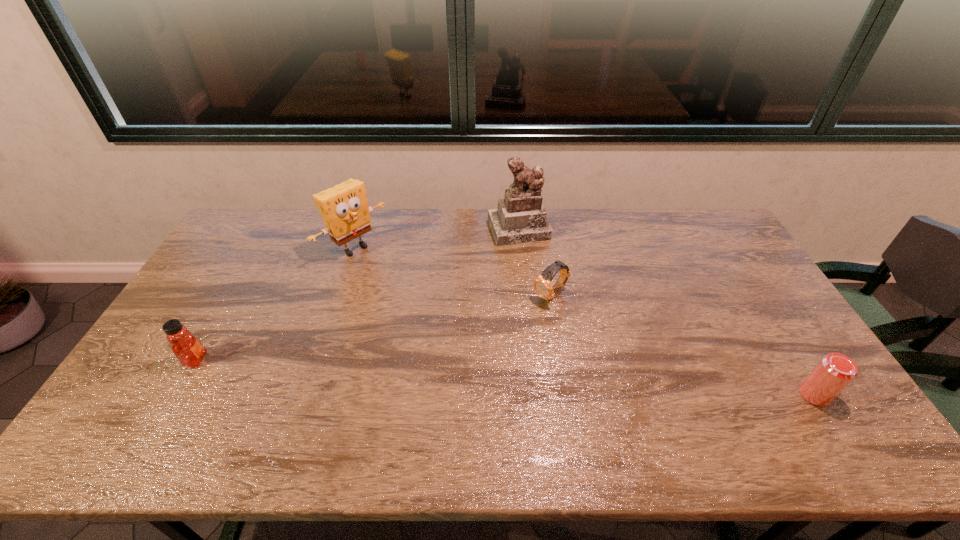
This screenshot has width=960, height=540. Identify the location of vacant space located on the face of the third farthest object. (474, 354).

Identify the location of free space located 0.140m on the face of the third farthest object. (507, 329).

Locate an element on the screen. The image size is (960, 540). free space located 0.130m on the face of the third farthest object is located at coordinates (509, 327).

The height and width of the screenshot is (540, 960). I want to click on free space located 0.220m on the front-facing side of the figurine, so click(x=542, y=289).

What are the coordinates of `vacant space located 0.380m on the front-facing side of the figurine` in the screenshot? It's located at (557, 327).

Where is `vacant area located 0.170m on the front-facing side of the figurine`? vacant area located 0.170m on the front-facing side of the figurine is located at coordinates (539, 279).

You are a GUI agent. You are given a task and a screenshot of the screen. Output one action in this format:
    pyautogui.click(x=<x>, y=<y>)
    Task: Click on the free space located on the face of the second tallest object
    The width and height of the screenshot is (960, 540).
    Given the screenshot: What is the action you would take?
    pyautogui.click(x=450, y=325)

At what (x,y) coordinates should I click in order to perform the action: click on vacant space positioned 0.310m on the face of the second tallest object. Please return your answer as a coordinate pair (x, y). The image size is (960, 540). Looking at the image, I should click on (432, 310).

Where is `free space located 0.210m on the face of the second tallest object`? The width and height of the screenshot is (960, 540). free space located 0.210m on the face of the second tallest object is located at coordinates (412, 294).

Where is `figurine that is at the far edge`? figurine that is at the far edge is located at coordinates (520, 217).